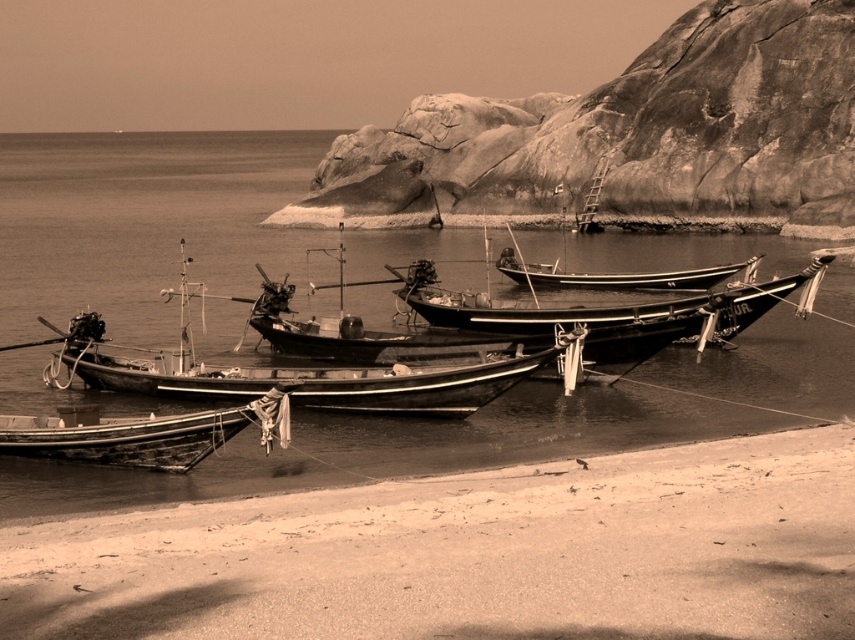
You are a photographer standing at the point marked as point (631, 138). What is the most prominent natural feature directly behind you?

The rugged stone cliff at upper center is directly behind the photographer at point (631, 138).

You are a photographer standing on the rugged stone cliff at upper center and want to take a photo of the wooden boat at center. Considering the height difference between the cliff and the boat, will the boat be fully visible in your photo without any obstructions?

The rugged stone cliff at upper center is much taller than the wooden boat at center, so the boat may be partially obscured by the cliff in the photo.